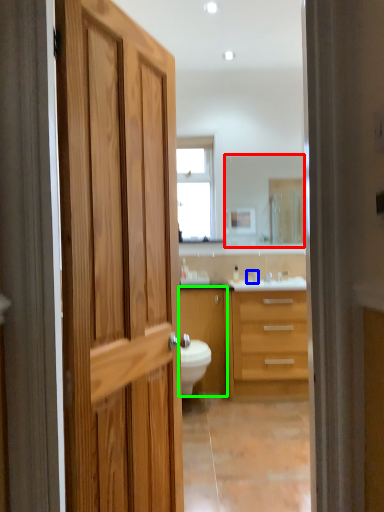
Question: Which object is positioned farthest from mirror (highlighted by a red box)? Select from faucet (highlighted by a blue box) and cabinetry (highlighted by a green box).

Choices:
 (A) faucet
 (B) cabinetry

Answer: (B)